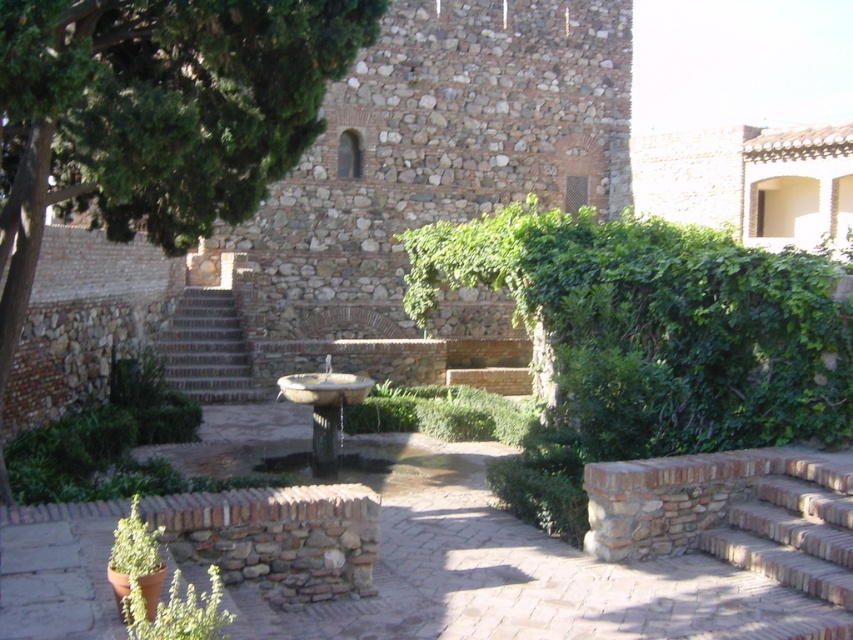
How far apart are green leafy tree at upper left and brick/stone stairs at lower right?

11.73 meters

In the scene shown: Does green leafy tree at upper left have a greater width compared to brick/stone stairs at lower right?

In fact, green leafy tree at upper left might be narrower than brick/stone stairs at lower right.

Is point (213, 54) more distant than point (838, 556)?

That is True.

Identify the location of green leafy tree at upper left. (155, 115).

You are a GUI agent. You are given a task and a screenshot of the screen. Output one action in this format:
    pyautogui.click(x=<x>, y=<y>)
    Task: Click on the green leafy tree at upper left
    
    Given the screenshot: What is the action you would take?
    pyautogui.click(x=155, y=115)

Find the location of a particular element. green leafy tree at upper left is located at coordinates (155, 115).

Based on the photo, is green leafy ivy at center positioned behind brick/stone stairs at lower right?

That is True.

Does green leafy ivy at center come in front of brick/stone stairs at lower right?

No, green leafy ivy at center is behind brick/stone stairs at lower right.

This screenshot has width=853, height=640. In order to click on green leafy ivy at center in this screenshot , I will do `click(656, 326)`.

Identify the location of green leafy ivy at center. The image size is (853, 640). (656, 326).